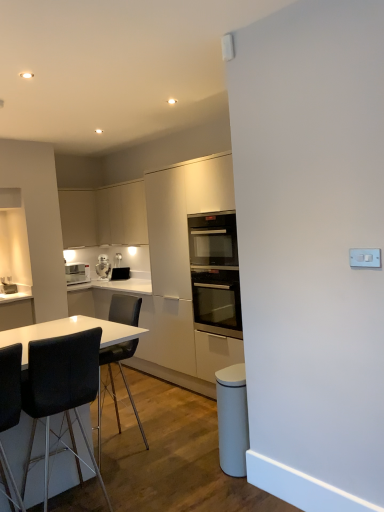
Question: In terms of height, does white glossy microwave at upper left, the second appliance viewed from the right, look taller or shorter compared to matte white cabinet at upper left, marked as the second cabinetry in a right-to-left arrangement?

Choices:
 (A) short
 (B) tall

Answer: (A)

Question: Based on their sizes in the image, would you say white glossy microwave at upper left, which is counted as the 1th appliance, starting from the left, is bigger or smaller than matte white cabinet at upper left, marked as the second cabinetry in a right-to-left arrangement?

Choices:
 (A) small
 (B) big

Answer: (A)

Question: Which object is positioned farthest from the matte black toaster at center, which is the 2th appliance from left to right?

Choices:
 (A) white glossy microwave at left
 (B) matte white cabinet at upper left, marked as the second cabinetry in a right-to-left arrangement
 (C) black leather chair at lower left, which is counted as the third chair, starting from the back
 (D) matte white cabinets at upper left, the second cabinetry viewed from the left
 (E) black leather chair at lower left, which is the 2th chair from front to back

Answer: (C)

Question: Which of these objects is positioned farthest from the black glass oven at center?

Choices:
 (A) white glossy microwave at upper left, the second appliance viewed from the right
 (B) matte black toaster at center, the first appliance viewed from the right
 (C) white glossy microwave at left
 (D) black leather chair at lower left, which is counted as the third chair, starting from the back
 (E) matte white cabinets at upper left, the second cabinetry viewed from the left

Answer: (C)